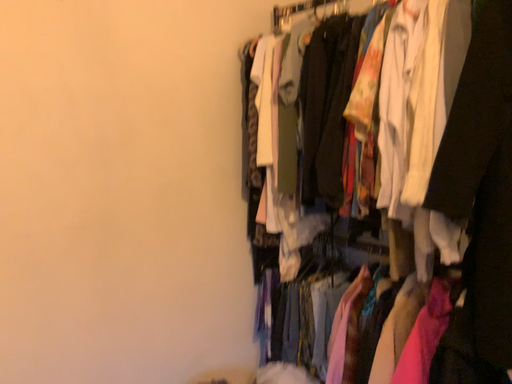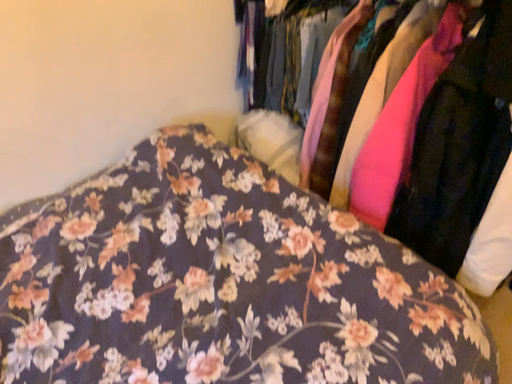
Question: Which way did the camera rotate in the video?

Choices:
 (A) rotated downward
 (B) rotated upward

Answer: (A)